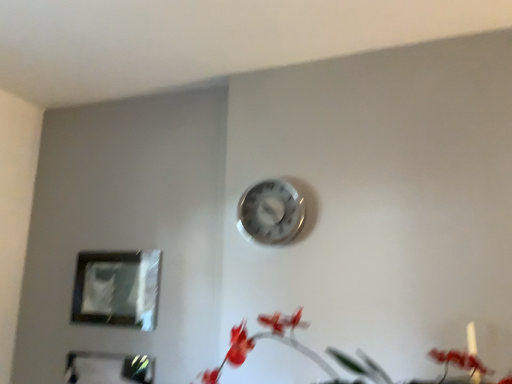
Question: Is matte plastic picture frame at lower left, which appears as the 2th picture frame when ordered from the bottom, located outside metallic silver clock at upper center?

Choices:
 (A) yes
 (B) no

Answer: (A)

Question: Does matte plastic picture frame at lower left, the first picture frame positioned from the top, have a smaller size compared to metallic silver clock at upper center?

Choices:
 (A) no
 (B) yes

Answer: (B)

Question: Can you confirm if matte plastic picture frame at lower left, which appears as the 2th picture frame when ordered from the bottom, is shorter than metallic silver clock at upper center?

Choices:
 (A) no
 (B) yes

Answer: (A)

Question: From a real-world perspective, is matte plastic picture frame at lower left, the first picture frame positioned from the top, beneath metallic silver clock at upper center?

Choices:
 (A) yes
 (B) no

Answer: (A)

Question: Considering the relative sizes of matte plastic picture frame at lower left, the first picture frame positioned from the top, and metallic silver clock at upper center in the image provided, is matte plastic picture frame at lower left, the first picture frame positioned from the top, taller than metallic silver clock at upper center?

Choices:
 (A) no
 (B) yes

Answer: (B)

Question: Is matte plastic picture frame at lower left, the first picture frame positioned from the top, beside metallic silver clock at upper center?

Choices:
 (A) yes
 (B) no

Answer: (B)

Question: Does metallic reflective frame at lower left, placed as the 2th picture frame when sorted from top to bottom, come in front of matte red flowers at lower right?

Choices:
 (A) yes
 (B) no

Answer: (B)

Question: Is metallic reflective frame at lower left, the 1th picture frame in the bottom-to-top sequence, outside of matte red flowers at lower right?

Choices:
 (A) no
 (B) yes

Answer: (B)

Question: Would you consider metallic reflective frame at lower left, the 1th picture frame in the bottom-to-top sequence, to be distant from matte red flowers at lower right?

Choices:
 (A) yes
 (B) no

Answer: (B)

Question: Is metallic reflective frame at lower left, the 1th picture frame in the bottom-to-top sequence, taller than matte red flowers at lower right?

Choices:
 (A) no
 (B) yes

Answer: (B)

Question: From the image's perspective, is metallic reflective frame at lower left, placed as the 2th picture frame when sorted from top to bottom, located above matte red flowers at lower right?

Choices:
 (A) no
 (B) yes

Answer: (A)

Question: Is matte red flowers at lower right completely or partially inside metallic reflective frame at lower left, the 1th picture frame in the bottom-to-top sequence?

Choices:
 (A) no
 (B) yes

Answer: (A)

Question: Considering the relative sizes of matte red flowers at lower right and metallic reflective frame at lower left, the 1th picture frame in the bottom-to-top sequence, in the image provided, is matte red flowers at lower right taller than metallic reflective frame at lower left, the 1th picture frame in the bottom-to-top sequence,?

Choices:
 (A) yes
 (B) no

Answer: (B)